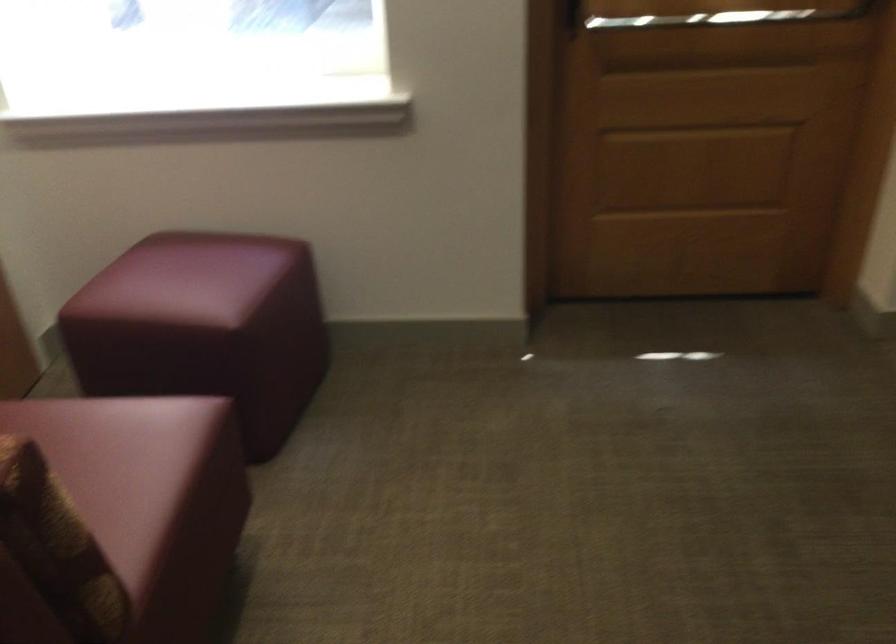
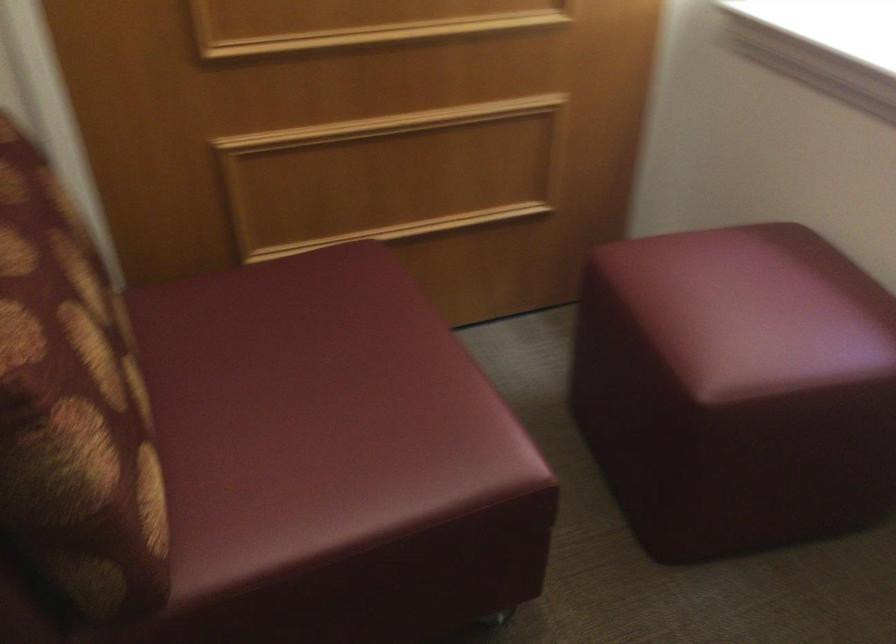
How did the camera likely rotate?

The rotation direction of the camera is left-down.